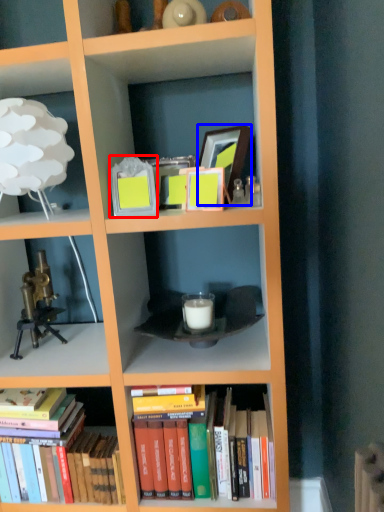
Question: Which object appears closest to the camera in this image, picture frame (highlighted by a red box) or picture frame (highlighted by a blue box)?

Choices:
 (A) picture frame
 (B) picture frame

Answer: (A)